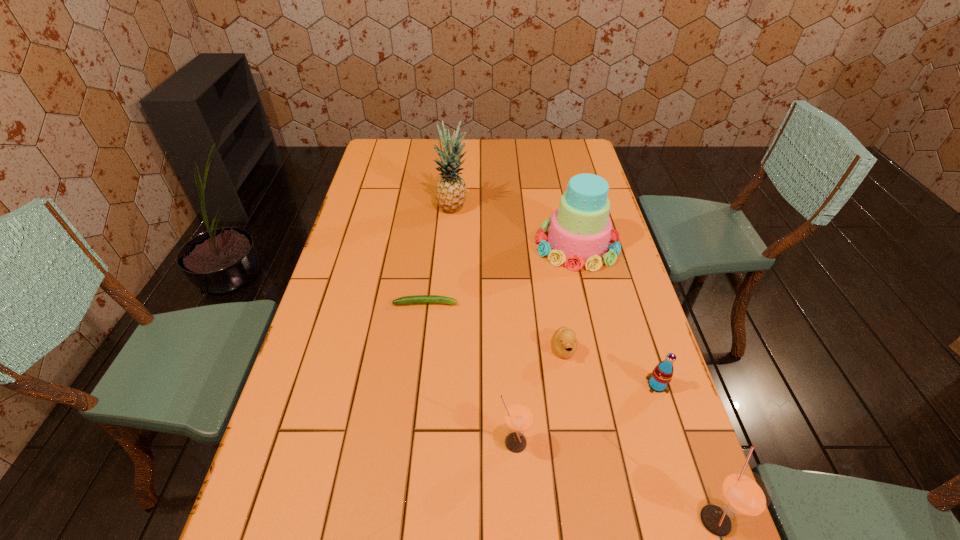
Observe the arrangement of all straws in the image. To keep them evenly spaced, where would you place another straw on the left? Please locate a free space. Please provide its 2D coordinates. Your answer should be formatted as a tuple, i.e. [(x, y)], where the tuple contains the x and y coordinates of a point satisfying the conditions above.

[(352, 383)]